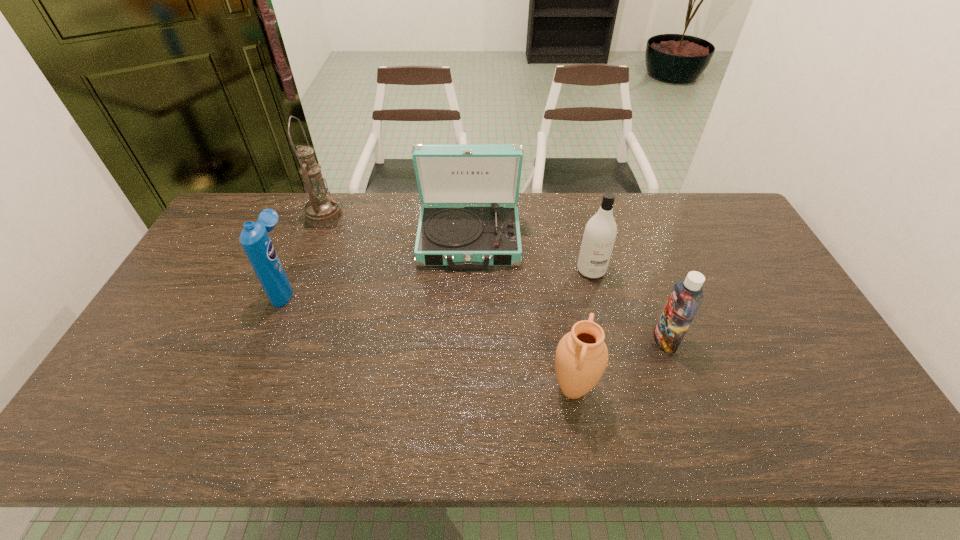
I want to click on vacant region located 0.380m on the front-facing side of the second shampoo from left to right, so click(621, 393).

Locate an element on the screen. The height and width of the screenshot is (540, 960). vacant area situated on the front of the leftmost shampoo is located at coordinates (268, 330).

The width and height of the screenshot is (960, 540). Identify the location of vacant area located on the front label of the rightmost shampoo. (595, 340).

Where is `free space located 0.250m on the front label of the rightmost shampoo`? This screenshot has height=540, width=960. free space located 0.250m on the front label of the rightmost shampoo is located at coordinates (562, 340).

The image size is (960, 540). I want to click on vacant space located 0.310m on the front label of the rightmost shampoo, so pyautogui.click(x=540, y=340).

You are a GUI agent. You are given a task and a screenshot of the screen. Output one action in this format:
    pyautogui.click(x=<x>, y=<y>)
    Task: Click on the vacant space positioned on the left of the nearest object
    
    Given the screenshot: What is the action you would take?
    pyautogui.click(x=440, y=389)

I want to click on oil lamp that is at the far edge, so click(321, 211).

Find the location of `record player that is at the far edge`. record player that is at the far edge is located at coordinates (462, 237).

Locate an element on the screen. The height and width of the screenshot is (540, 960). object at the near edge is located at coordinates (581, 358).

At what (x,y) coordinates should I click in order to perform the action: click on vacant space at the far edge of the desktop. Please return your answer as a coordinate pair (x, y). The height and width of the screenshot is (540, 960). Looking at the image, I should click on coord(384,199).